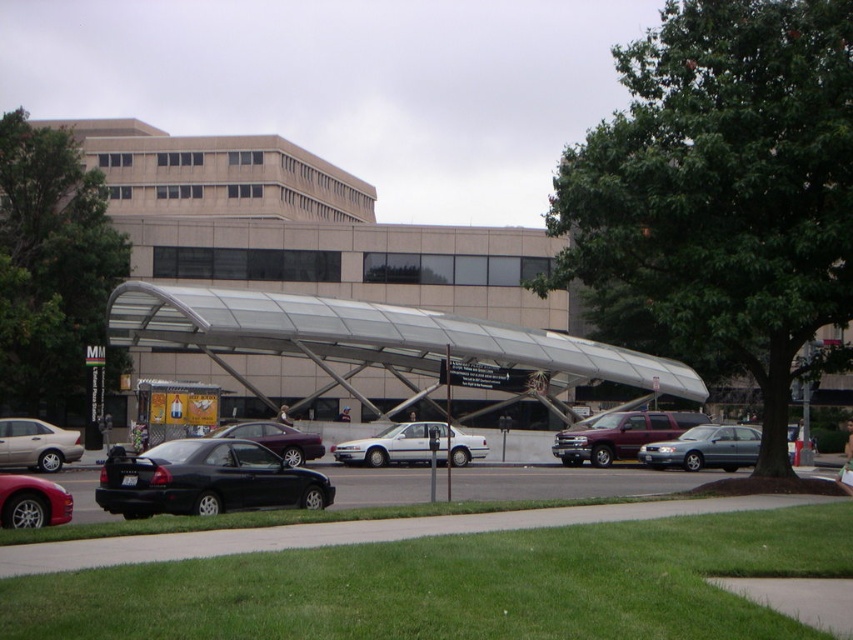
You are a parking attendant and need to fit a new car that is 1.8 meters wide into the space between the matte black sedan at lower left and the shiny black sedan at center. Can the new car fit based on their widths?

The matte black sedan at lower left is thinner than the shiny black sedan at center, so the space between them may be too narrow for the new car that is 1.8 meters wide. The attendant should check the exact width of the available space before deciding.

You are a parking attendant who needs to fit a new compact car into a space between the black car at lower left and the white matte sedan at center. Can the new compact car fit in the space between them?

The black car at lower left is wider than the white matte sedan at center. Since the compact car requires a standard width of about 1.8 meters, and the space between them may vary depending on their widths, but since the black car is wider, the space might be sufficient. However, without exact measurements, it is uncertain. Please check the actual space available.